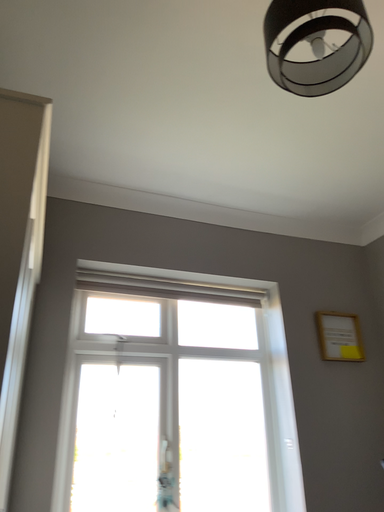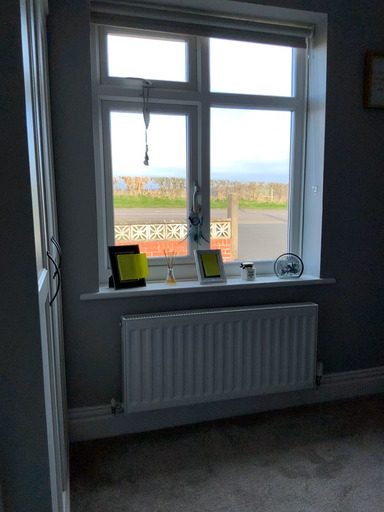
Question: How did the camera likely rotate when shooting the video?

Choices:
 (A) rotated upward
 (B) rotated downward

Answer: (B)